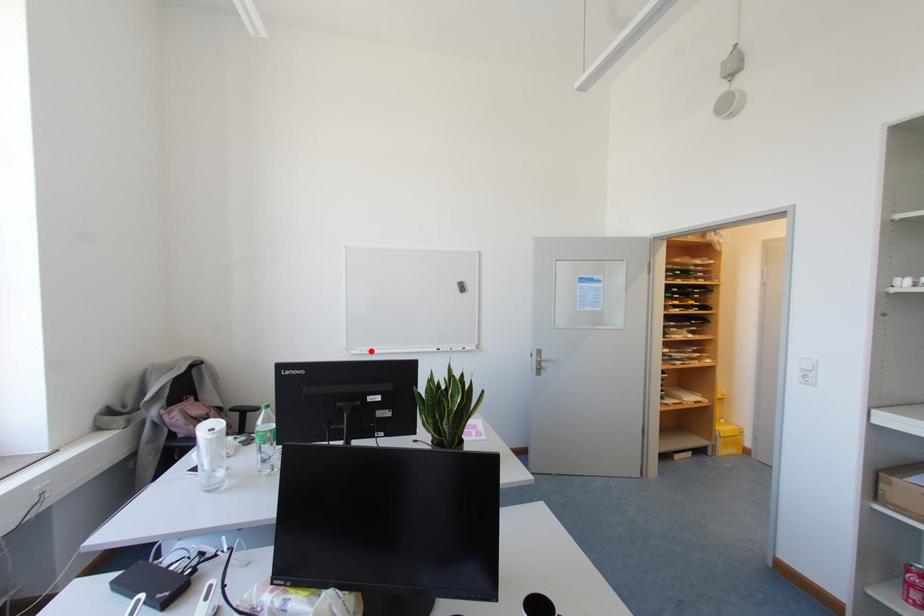
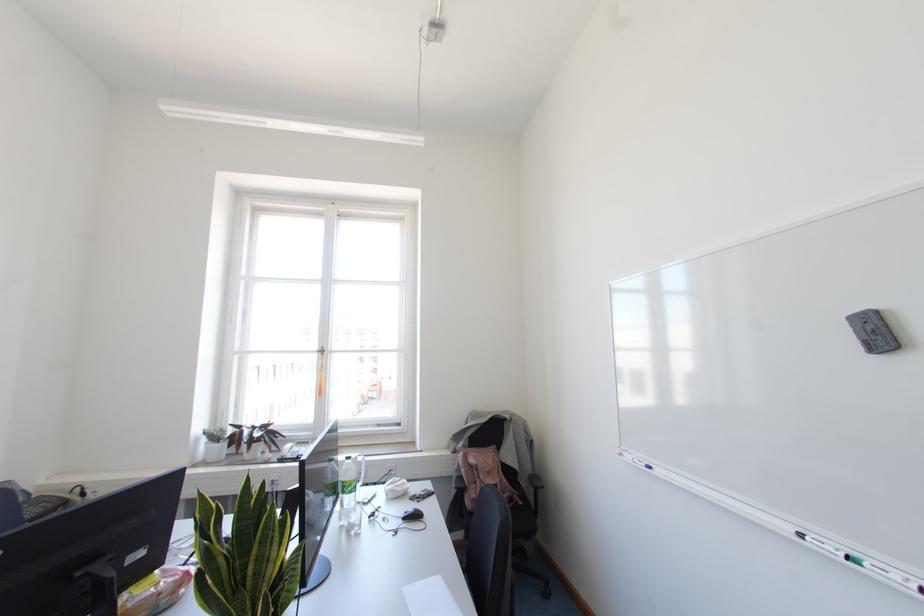
In the second image, find the point that corresponds to the highlighted location in the first image.

(649, 467)